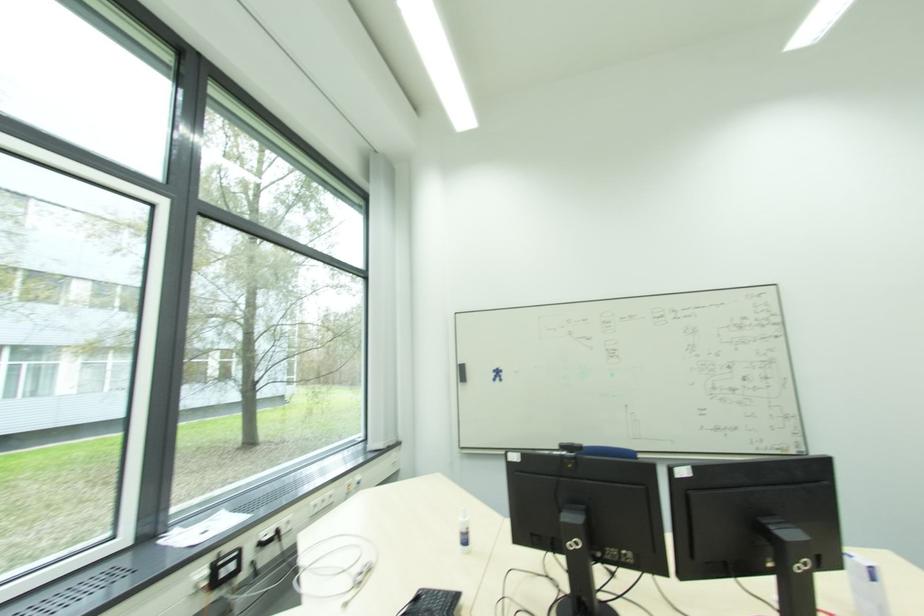
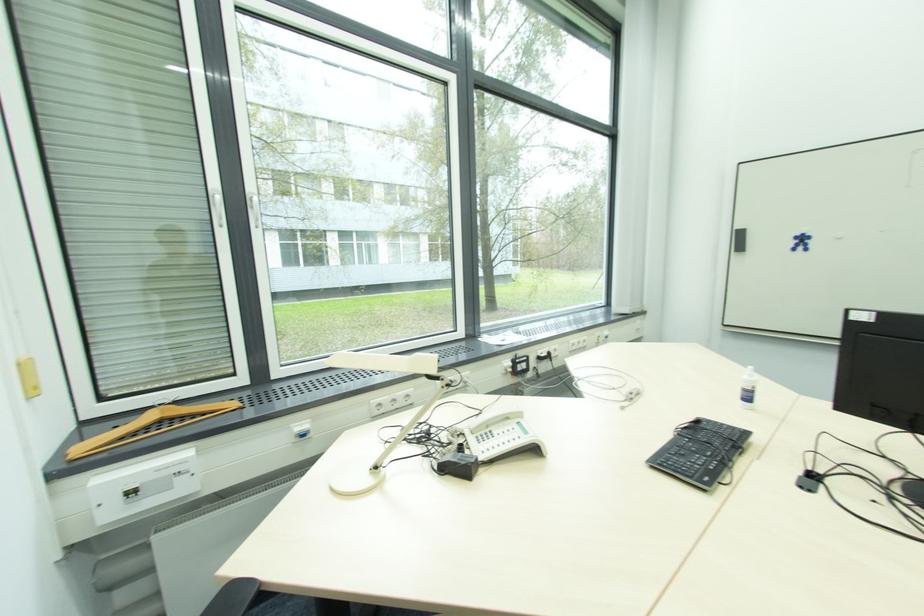
In the second image, find the point that corresponds to point 497,377 in the first image.

(801, 244)